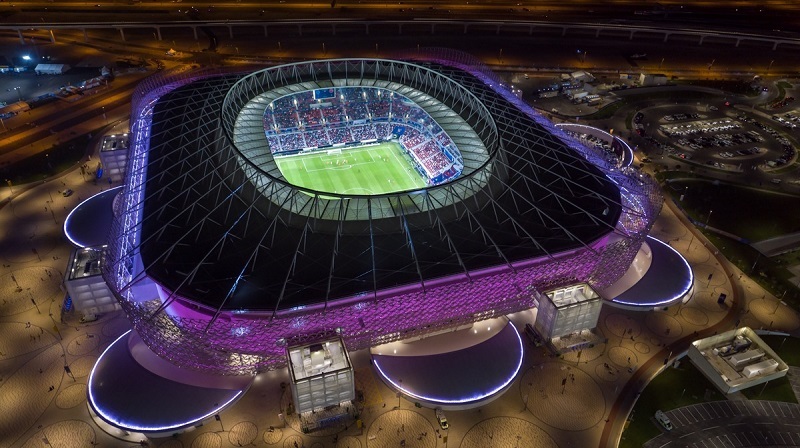
The width and height of the screenshot is (800, 448). Find the location of `cover`. cover is located at coordinates (658, 279).